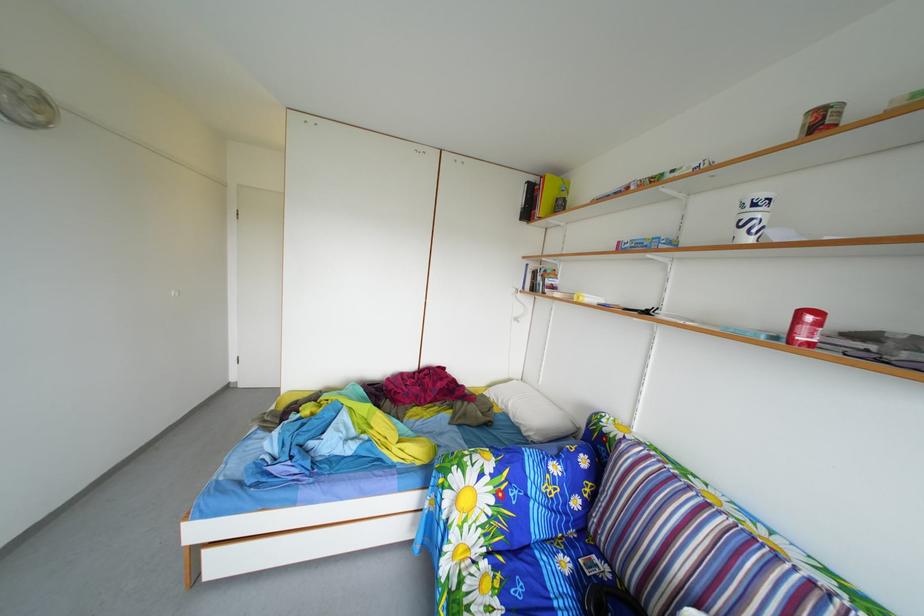
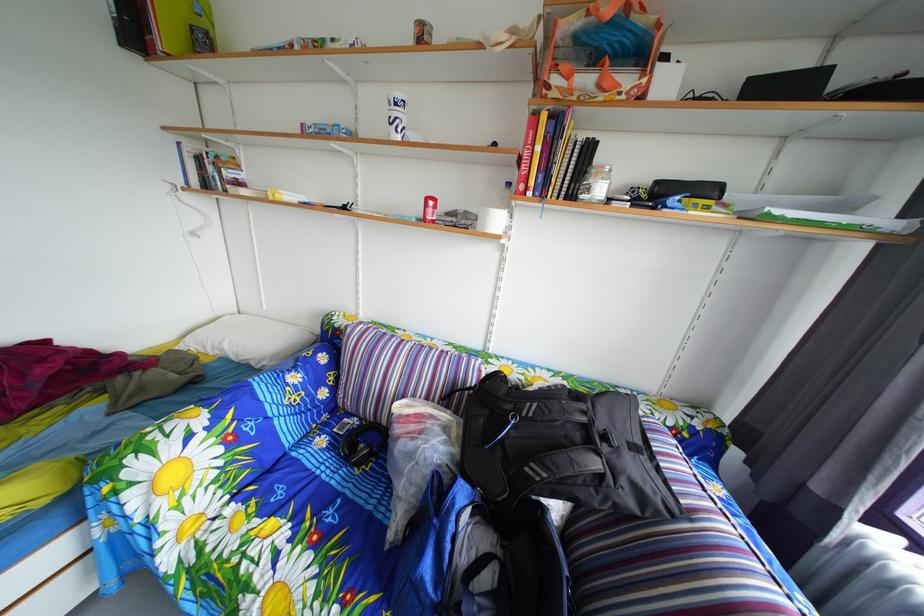
Locate, in the second image, the point that corresponds to pixel 513 411 in the first image.

(224, 357)